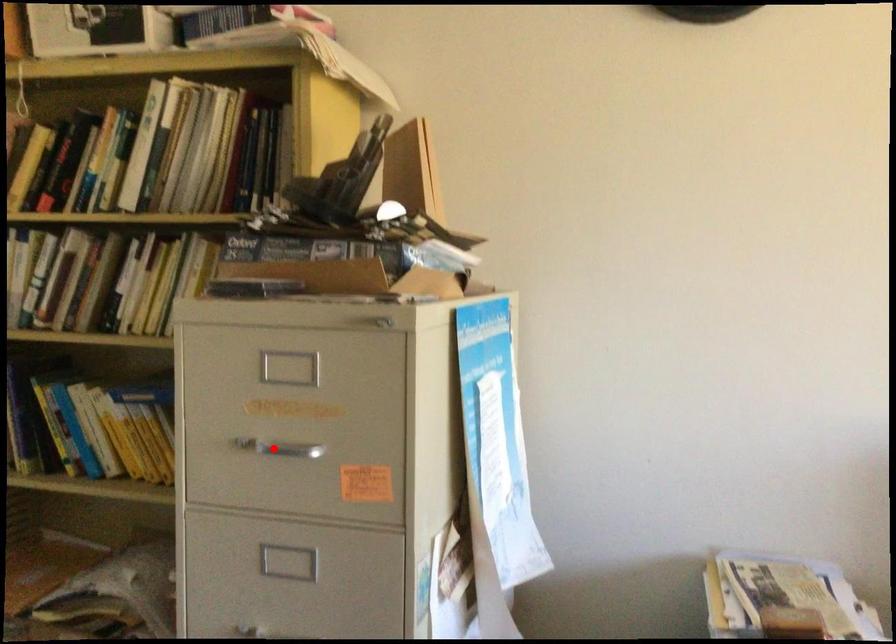
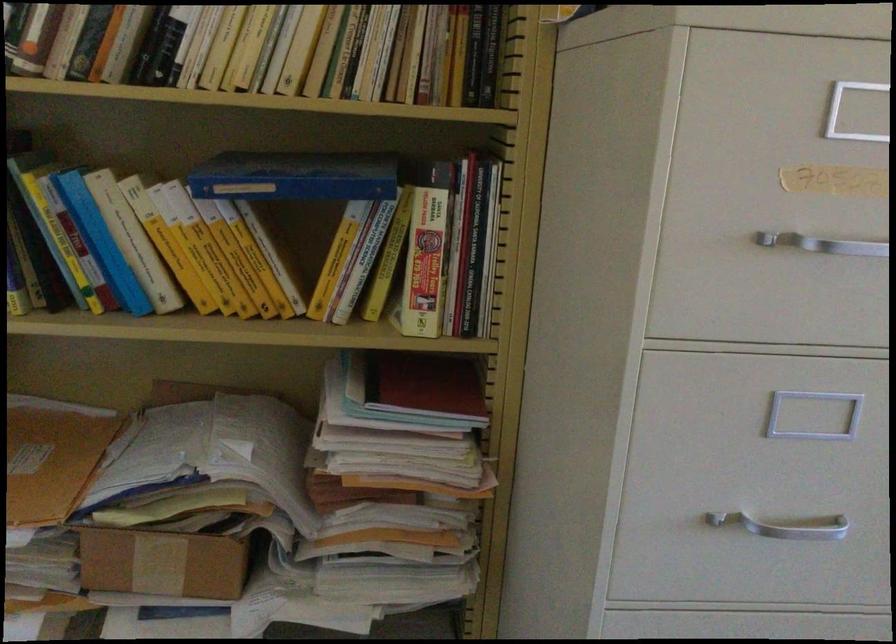
Question: A red point is marked in image1. In image2, is the corresponding 3D point closer to the camera or farther? Reply with the corresponding letter.

Choices:
 (A) The corresponding 3D point is closer.
 (B) The corresponding 3D point is farther.

Answer: (A)